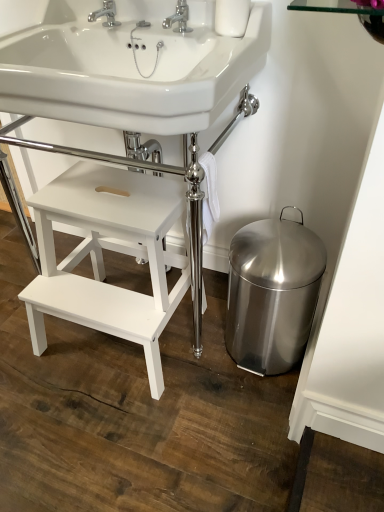
Question: Is chrome metallic faucet at upper center, which is the 1th tap in right-to-left order, at the right side of white glossy sink at upper center, which is counted as the 1th sink, starting from the top?

Choices:
 (A) no
 (B) yes

Answer: (B)

Question: From a real-world perspective, is chrome metallic faucet at upper center, acting as the second tap starting from the left, located beneath white glossy sink at upper center, which is counted as the 1th sink, starting from the top?

Choices:
 (A) yes
 (B) no

Answer: (B)

Question: From a real-world perspective, is chrome metallic faucet at upper center, which is the 1th tap in right-to-left order, over white glossy sink at upper center, the 2th sink positioned from the bottom?

Choices:
 (A) no
 (B) yes

Answer: (B)

Question: From the image's perspective, is chrome metallic faucet at upper center, acting as the second tap starting from the left, on white glossy sink at upper center, which is counted as the 1th sink, starting from the top?

Choices:
 (A) no
 (B) yes

Answer: (B)

Question: Considering the relative sizes of chrome metallic faucet at upper center, which is the 1th tap in right-to-left order, and white glossy sink at upper center, the 2th sink positioned from the bottom, in the image provided, is chrome metallic faucet at upper center, which is the 1th tap in right-to-left order, bigger than white glossy sink at upper center, the 2th sink positioned from the bottom,?

Choices:
 (A) no
 (B) yes

Answer: (A)

Question: Is silver metallic faucet at upper center, arranged as the 2th tap when viewed from the right, bigger or smaller than white glossy sink at upper center, which is the second sink in top-to-bottom order?

Choices:
 (A) small
 (B) big

Answer: (A)

Question: From the image's perspective, relative to white glossy sink at upper center, positioned as the 1th sink in bottom-to-top order, is silver metallic faucet at upper center, the first tap in the left-to-right sequence, above or below?

Choices:
 (A) below
 (B) above

Answer: (B)

Question: Looking at their shapes, would you say silver metallic faucet at upper center, arranged as the 2th tap when viewed from the right, is wider or thinner than white glossy sink at upper center, positioned as the 1th sink in bottom-to-top order?

Choices:
 (A) wide
 (B) thin

Answer: (B)

Question: Is silver metallic faucet at upper center, the first tap in the left-to-right sequence, to the left or to the right of white glossy sink at upper center, positioned as the 1th sink in bottom-to-top order, in the image?

Choices:
 (A) left
 (B) right

Answer: (A)

Question: Considering their positions, is white glossy sink at upper center, which is the second sink in top-to-bottom order, located in front of or behind stainless steel bidet at lower right?

Choices:
 (A) front
 (B) behind

Answer: (A)

Question: Is white glossy sink at upper center, positioned as the 1th sink in bottom-to-top order, inside or outside of stainless steel bidet at lower right?

Choices:
 (A) inside
 (B) outside

Answer: (B)

Question: Considering the relative positions of white glossy sink at upper center, which is the second sink in top-to-bottom order, and stainless steel bidet at lower right in the image provided, is white glossy sink at upper center, which is the second sink in top-to-bottom order, to the left or to the right of stainless steel bidet at lower right?

Choices:
 (A) left
 (B) right

Answer: (A)

Question: Is point (24, 42) positioned closer to the camera than point (251, 325)?

Choices:
 (A) farther
 (B) closer

Answer: (B)

Question: Based on their sizes in the image, would you say stainless steel bidet at lower right is bigger or smaller than chrome metallic faucet at upper center, which is the 1th tap in right-to-left order?

Choices:
 (A) small
 (B) big

Answer: (B)

Question: Is stainless steel bidet at lower right in front of or behind chrome metallic faucet at upper center, acting as the second tap starting from the left, in the image?

Choices:
 (A) front
 (B) behind

Answer: (B)